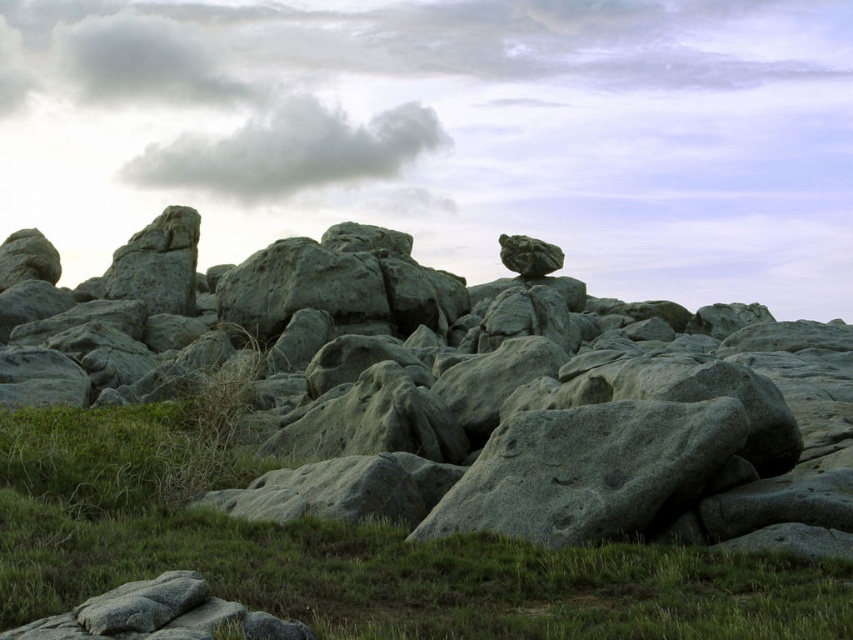
You are standing at the point marked by the coordinate point at point (468, 392). What object are you directly standing on?

You are directly standing on the gray rough rock at center located at point (468, 392).